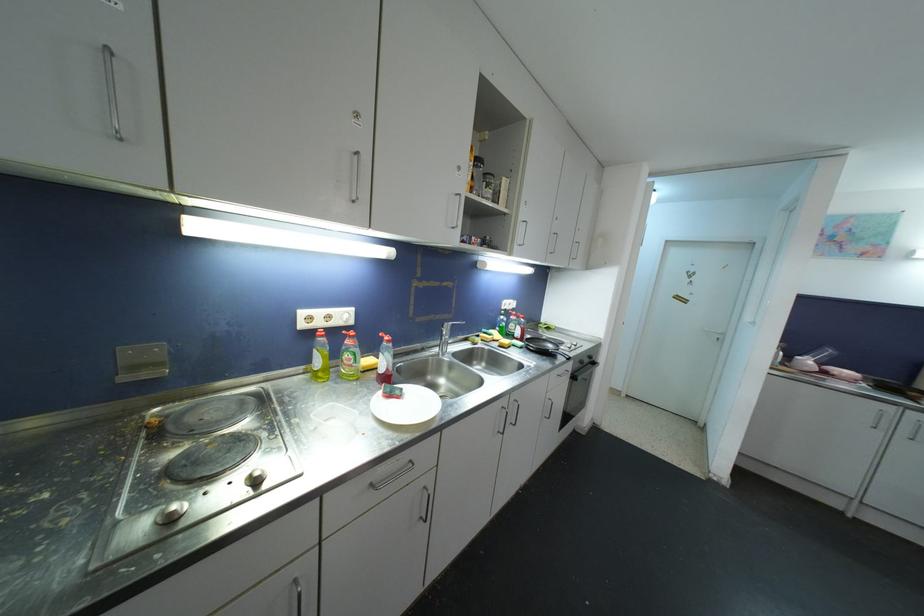
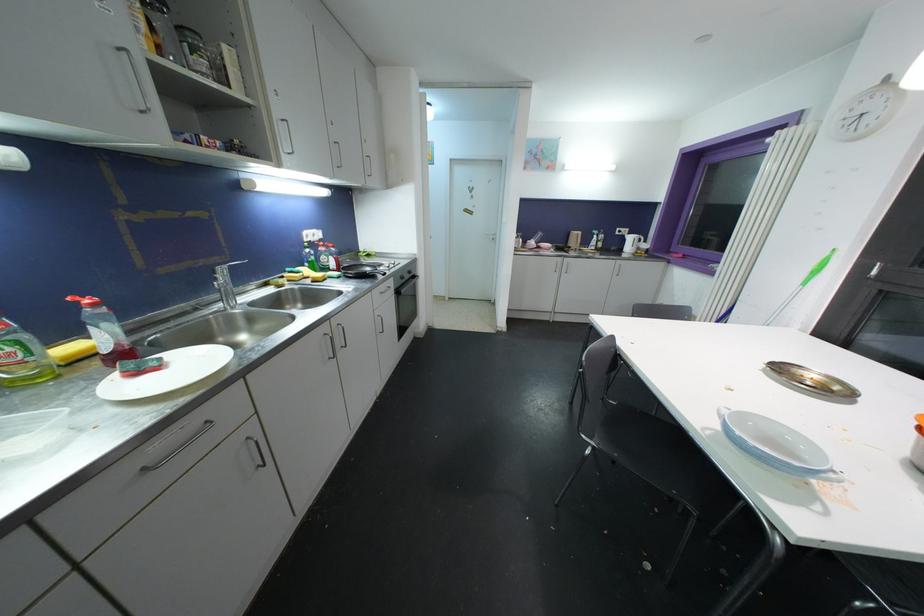
Find the pixel in the second image that matches [517,399] in the first image.

(337, 323)